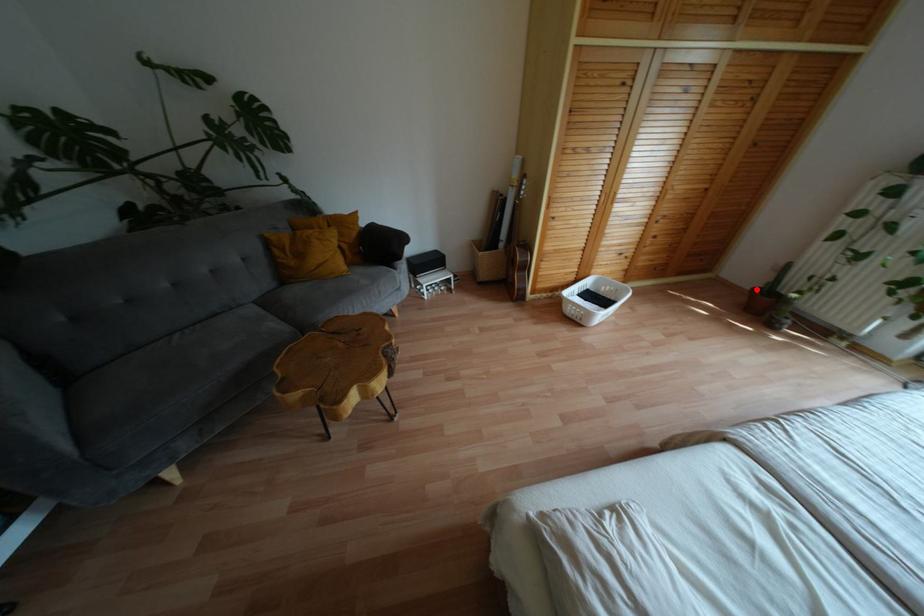
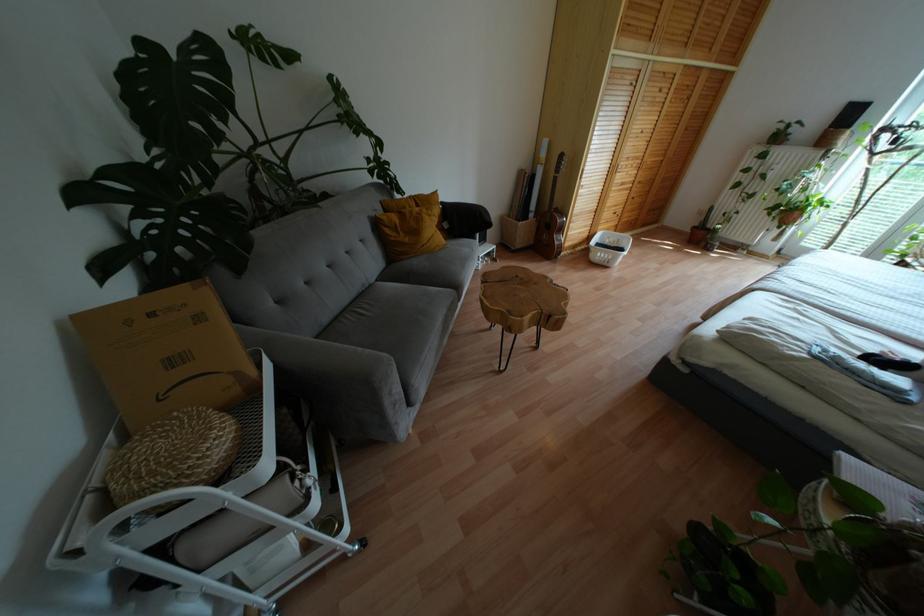
Where in the second image is the point corresponding to the highlighted location from the first image?

(694, 227)